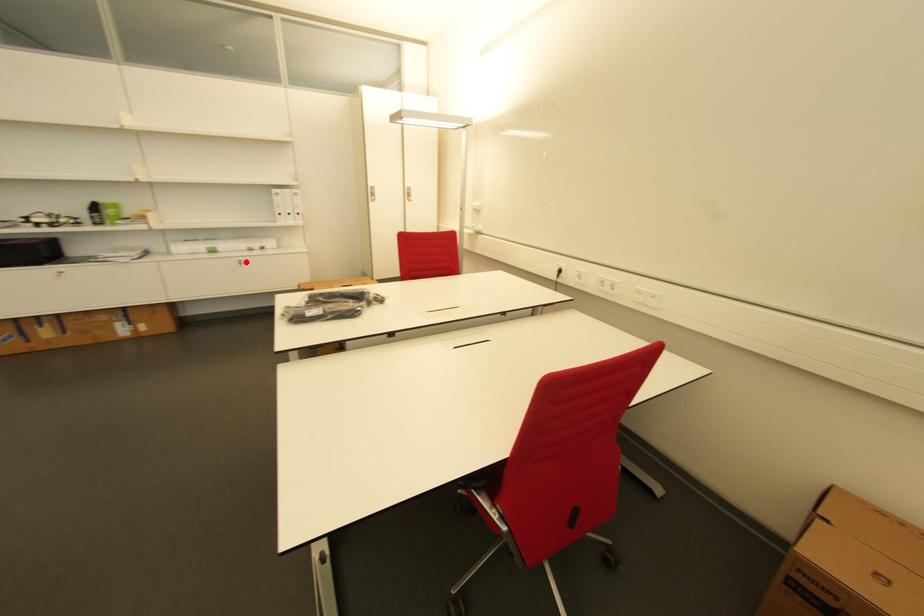
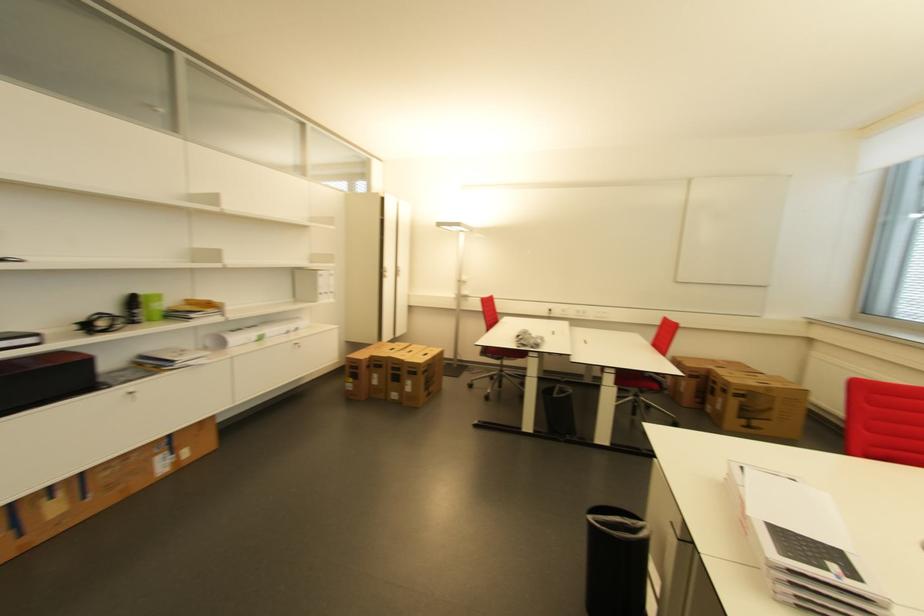
Find the pixel in the second image that matches the highlighted location in the first image.

(300, 345)